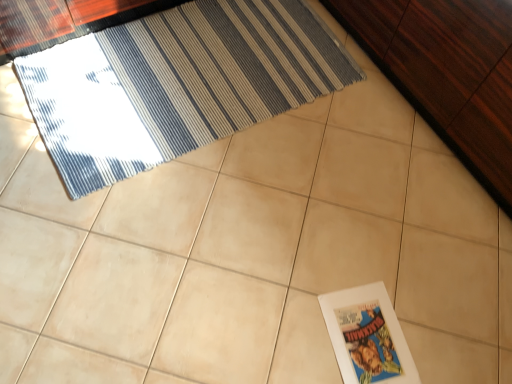
Identify the location of vacant point above white paper at lower right (from a real-world perspective). Image resolution: width=512 pixels, height=384 pixels. (375, 340).